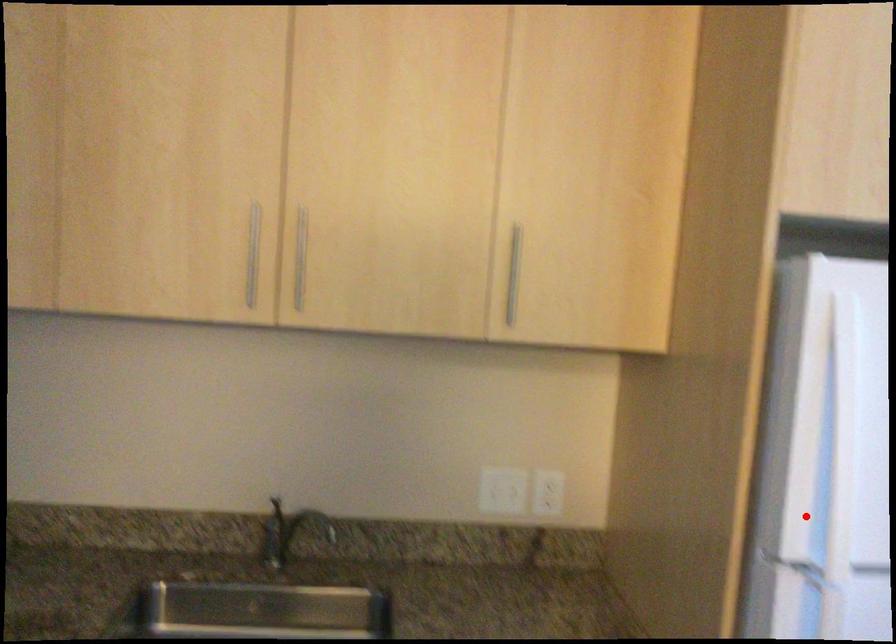
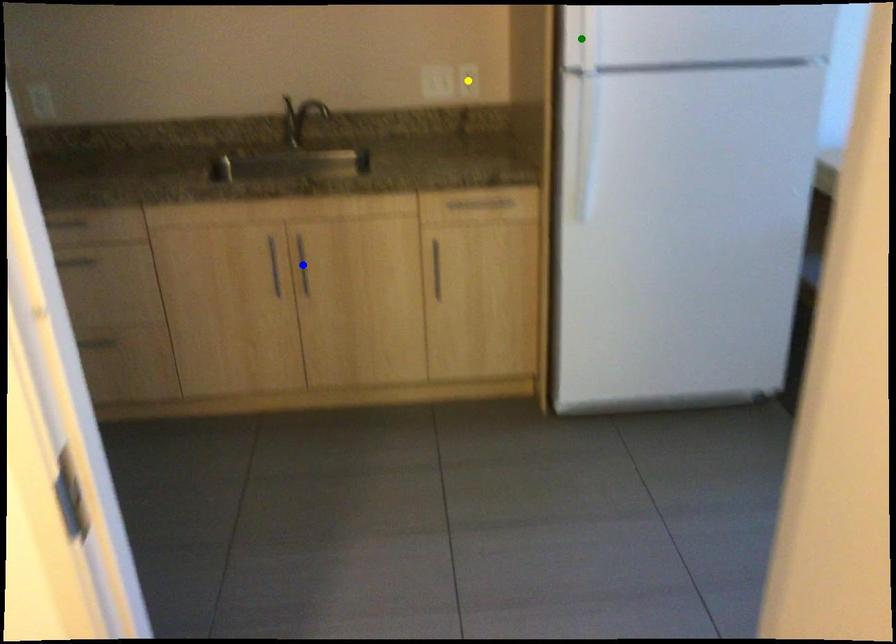
Question: I am providing you with two images of the same scene from different viewpoints. A red point is marked on the first image. You are given multiple points on the second image. Which point in image 2 is actually the same real-world point as the red point in image 1?

Choices:
 (A) green point
 (B) yellow point
 (C) blue point

Answer: (A)